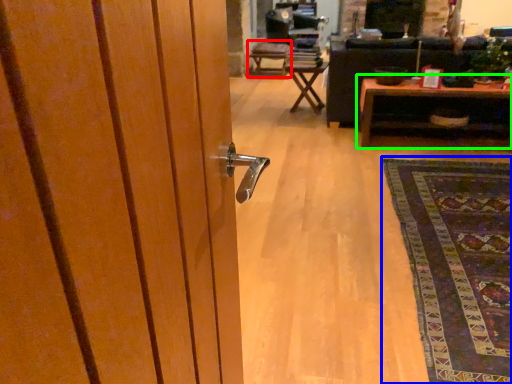
Question: Based on their relative distances, which object is nearer to chair (highlighted by a red box)? Choose from mat (highlighted by a blue box) and table (highlighted by a green box).

Choices:
 (A) mat
 (B) table

Answer: (B)